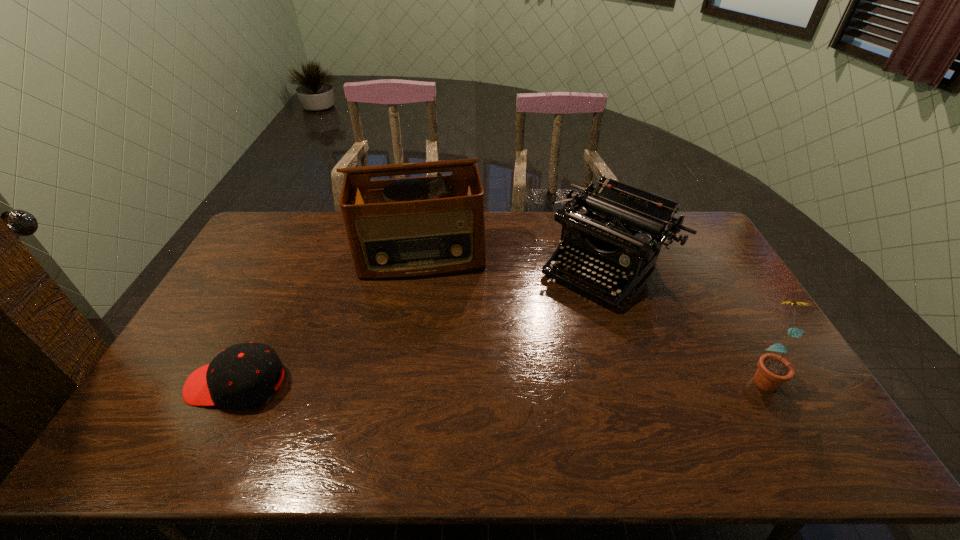
The image size is (960, 540). Find the location of `object at the near right corner`. object at the near right corner is located at coordinates (773, 370).

Where is `free region at the far edge`? The width and height of the screenshot is (960, 540). free region at the far edge is located at coordinates (548, 248).

The image size is (960, 540). I want to click on vacant area at the near edge, so click(x=550, y=410).

In the image, there is a desktop. Identify the location of vacant region at the left edge. This screenshot has width=960, height=540. (277, 266).

In the image, there is a desktop. At what (x,y) coordinates should I click in order to perform the action: click on free region at the right edge. Please return your answer as a coordinate pair (x, y). This screenshot has height=540, width=960. Looking at the image, I should click on (734, 305).

This screenshot has width=960, height=540. I want to click on free space between the rightmost object and the leftmost object, so click(499, 379).

Identify the location of free spot between the sunflower and the tallest object. (590, 315).

Locate an element on the screen. free space between the shortest object and the rightmost object is located at coordinates (499, 379).

At what (x,y) coordinates should I click in order to perform the action: click on vacant region between the typewriter and the shortest object. Please return your answer as a coordinate pair (x, y). The height and width of the screenshot is (540, 960). Looking at the image, I should click on (421, 325).

Locate an element on the screen. free area in between the radio receiver and the cap is located at coordinates (328, 319).